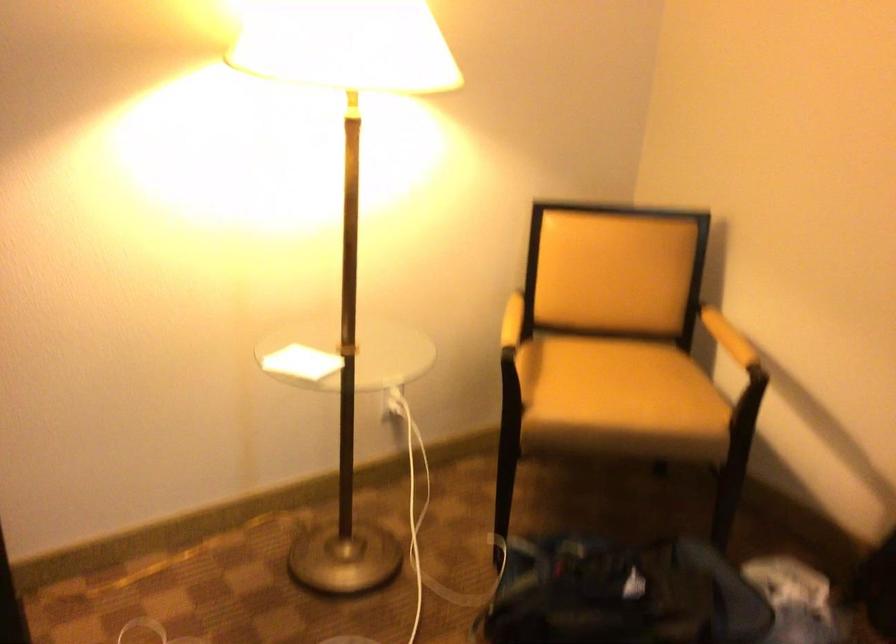
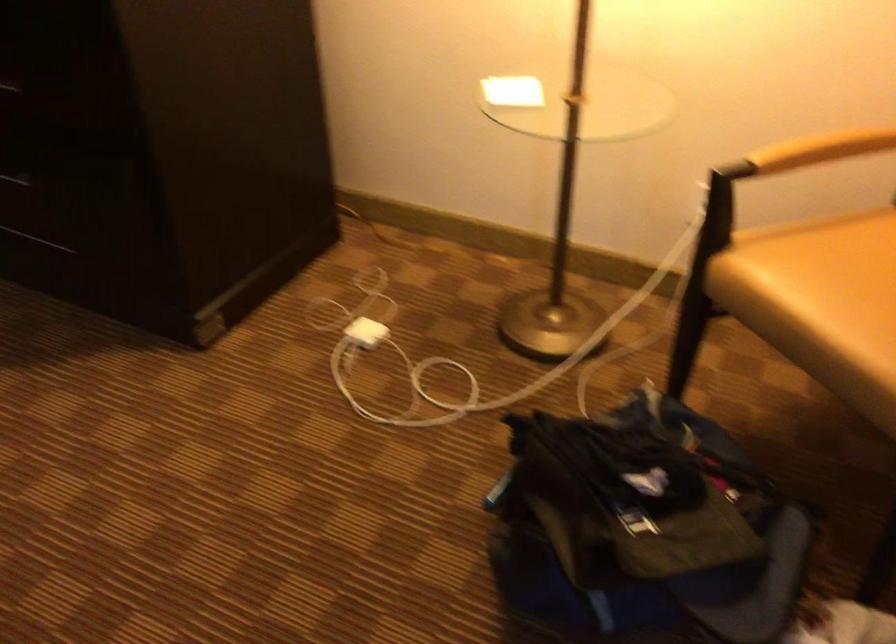
Find the pixel in the second image that matches the point at 300,357 in the first image.

(513, 91)